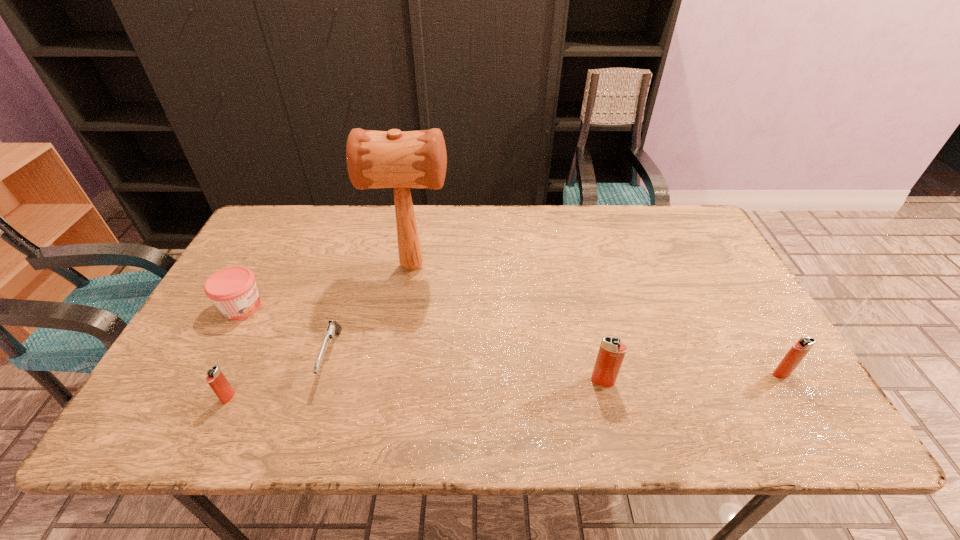
Where is `the nearest igniter`? The height and width of the screenshot is (540, 960). the nearest igniter is located at coordinates click(217, 381).

Find the location of a particular element. The height and width of the screenshot is (540, 960). the leftmost igniter is located at coordinates (217, 381).

Where is `the fifth object from left to right`? This screenshot has width=960, height=540. the fifth object from left to right is located at coordinates (611, 353).

Identify the location of the tallest igniter. (611, 353).

Where is `the fourth shortest object`? The width and height of the screenshot is (960, 540). the fourth shortest object is located at coordinates (799, 350).

Where is `the rightmost igniter`? The image size is (960, 540). the rightmost igniter is located at coordinates (799, 350).

Locate an element on the screen. The height and width of the screenshot is (540, 960). the shortest object is located at coordinates (333, 327).

Where is `the fourth object from right to left`? Image resolution: width=960 pixels, height=540 pixels. the fourth object from right to left is located at coordinates (333, 327).

This screenshot has width=960, height=540. In order to click on the farthest object in this screenshot , I will do (x=393, y=159).

At what (x,y) coordinates should I click in order to perform the action: click on the third object from right to left. Please return your answer as a coordinate pair (x, y). Looking at the image, I should click on (393, 159).